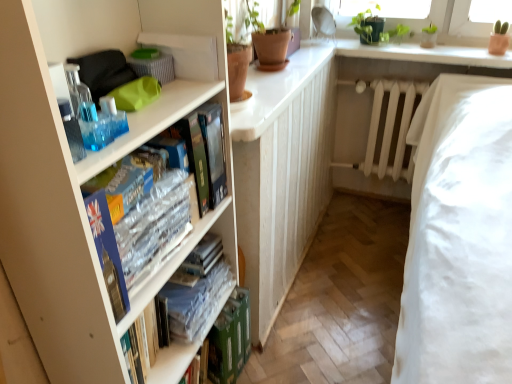
This screenshot has width=512, height=384. In order to click on free region under green matte plant at upper right (from a real-world perspective) in this screenshot , I will do `click(378, 47)`.